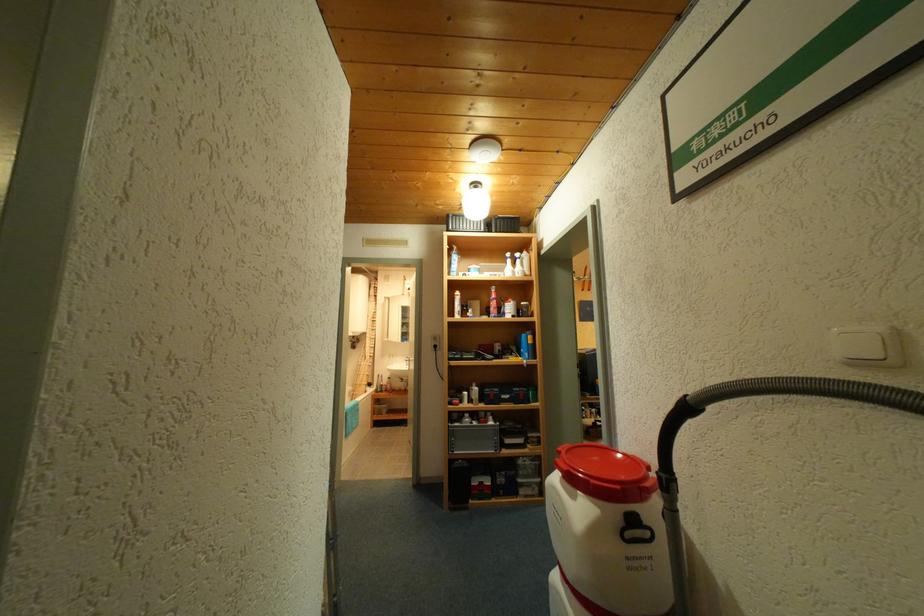
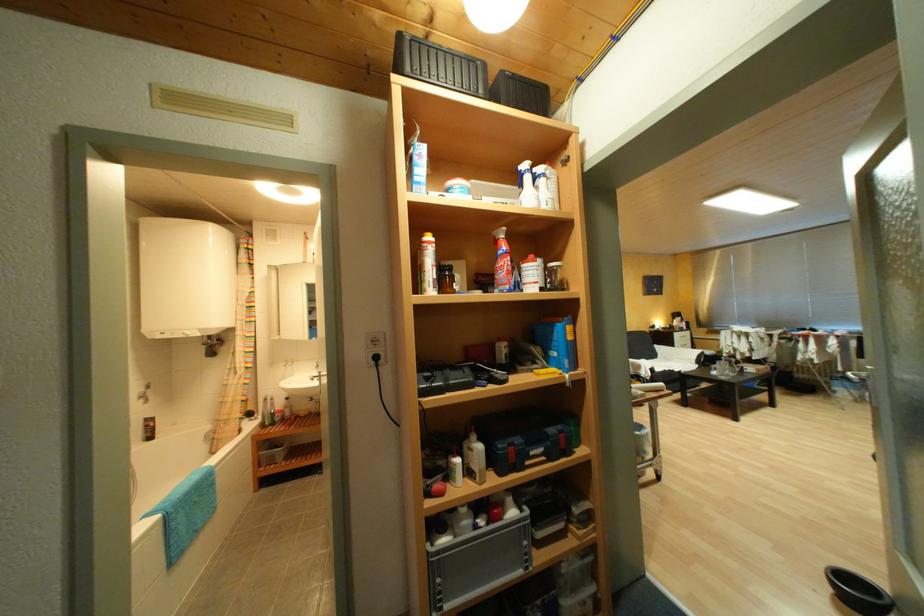
In the second image, find the point that corresponds to [475,394] in the first image.

(467, 461)